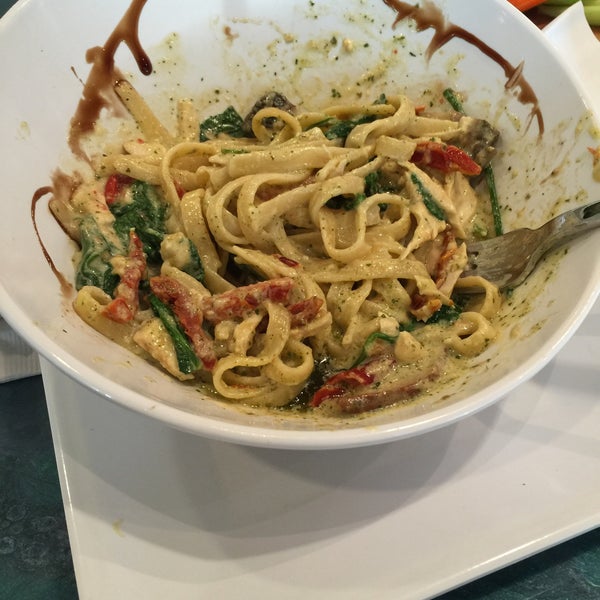
The width and height of the screenshot is (600, 600). I want to click on plate, so click(262, 507).